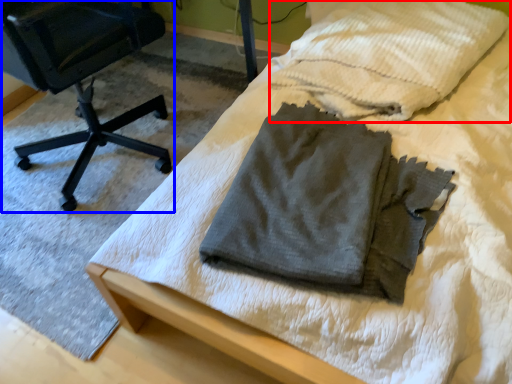
Question: Which object is further to the camera taking this photo, cloth (highlighted by a red box) or chair (highlighted by a blue box)?

Choices:
 (A) cloth
 (B) chair

Answer: (A)